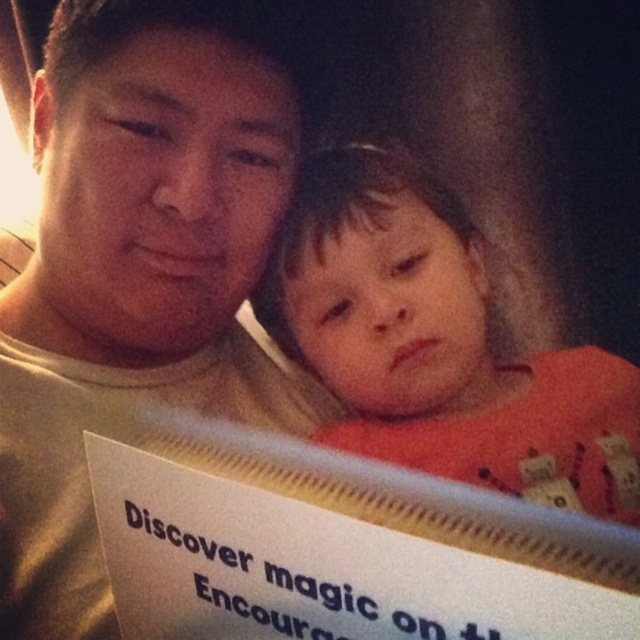
You are standing 20 inches away from a point marked at coordinates point [29,518]. Can you reach it without moving your feet?

The distance of point [29,518] from viewer is 21.27 inches, so you are currently 20 inches away from it. Since the distance is slightly more than your reach, you cannot reach it without moving your feet.

You are a photographer trying to capture the scene where the matte beige shirt at center and the orange cotton shirt at center are visible. Which shirt should you focus on if you want to highlight the one closer to the camera?

The matte beige shirt at center is above the orange cotton shirt at center, so focusing on the matte beige shirt at center would highlight the one closer to the camera since it is positioned in front.

Based on the scene described, which individual is taller between the matte beige shirt at center and the orange cotton shirt at center?

The matte beige shirt at center is taller than the orange cotton shirt at center according to the description.